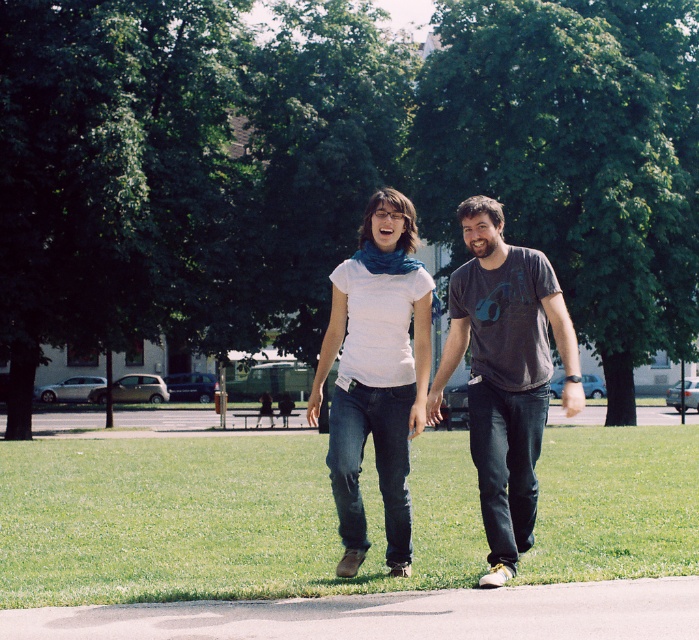
Who is more distant from viewer, (151, 548) or (421, 609)?

The point (151, 548) is more distant.

Locate an element on the screen. Image resolution: width=699 pixels, height=640 pixels. green grass at center is located at coordinates (216, 518).

Locate an element on the screen. This screenshot has width=699, height=640. green grass at center is located at coordinates (216, 518).

Which is above, green grass at center or dark gray t-shirt at center?

dark gray t-shirt at center is above.

Can you confirm if green grass at center is shorter than dark gray t-shirt at center?

Indeed, green grass at center has a lesser height compared to dark gray t-shirt at center.

Between point (675, 513) and point (475, 248), which one is positioned in front?

Point (475, 248) is more forward.

Locate an element on the screen. Image resolution: width=699 pixels, height=640 pixels. green grass at center is located at coordinates (216, 518).

Between gray asphalt at lower center and dark gray t-shirt at center, which one appears on the right side from the viewer's perspective?

Positioned to the right is dark gray t-shirt at center.

Who is shorter, gray asphalt at lower center or dark gray t-shirt at center?

gray asphalt at lower center

This screenshot has height=640, width=699. What do you see at coordinates (391, 614) in the screenshot?
I see `gray asphalt at lower center` at bounding box center [391, 614].

Locate an element on the screen. This screenshot has height=640, width=699. gray asphalt at lower center is located at coordinates (391, 614).